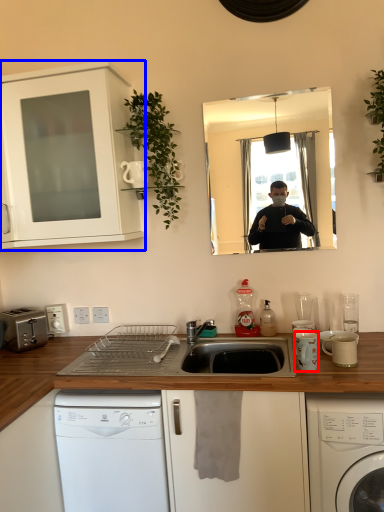
Question: Which object appears closest to the camera in this image, appliance (highlighted by a red box) or cabinetry (highlighted by a blue box)?

Choices:
 (A) appliance
 (B) cabinetry

Answer: (A)